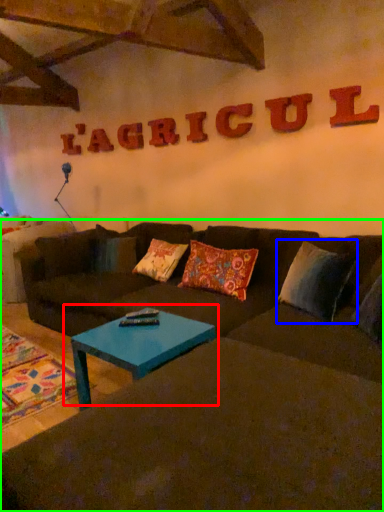
Question: Estimate the real-world distances between objects in this image. Which object is farther from coffee table (highlighted by a red box), pillow (highlighted by a blue box) or studio couch (highlighted by a green box)?

Choices:
 (A) pillow
 (B) studio couch

Answer: (A)